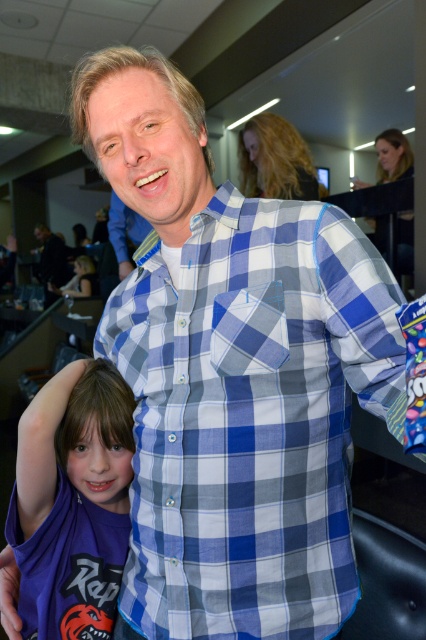
Question: Which point is farther from the camera taking this photo?

Choices:
 (A) (294, 220)
 (B) (25, 410)

Answer: (B)

Question: Can you confirm if blue plaid shirt at center is thinner than purple matte shirt at lower left?

Choices:
 (A) yes
 (B) no

Answer: (B)

Question: Does blue plaid shirt at center have a larger size compared to purple matte shirt at lower left?

Choices:
 (A) no
 (B) yes

Answer: (B)

Question: Among these points, which one is nearest to the camera?

Choices:
 (A) (103, 422)
 (B) (322, 234)

Answer: (B)

Question: Is blue plaid shirt at center thinner than purple matte shirt at lower left?

Choices:
 (A) no
 (B) yes

Answer: (A)